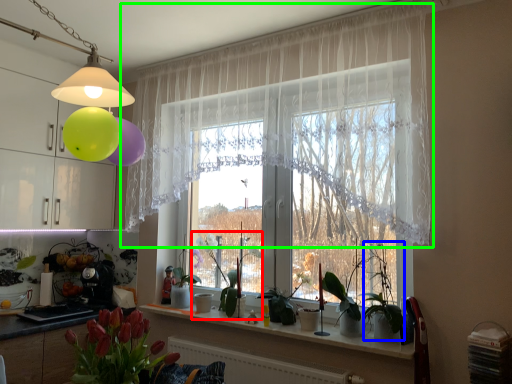
Question: Considering the real-world distances, which object is farthest from plant (highlighted by a red box)? plant (highlighted by a blue box) or curtain (highlighted by a green box)?

Choices:
 (A) plant
 (B) curtain

Answer: (B)